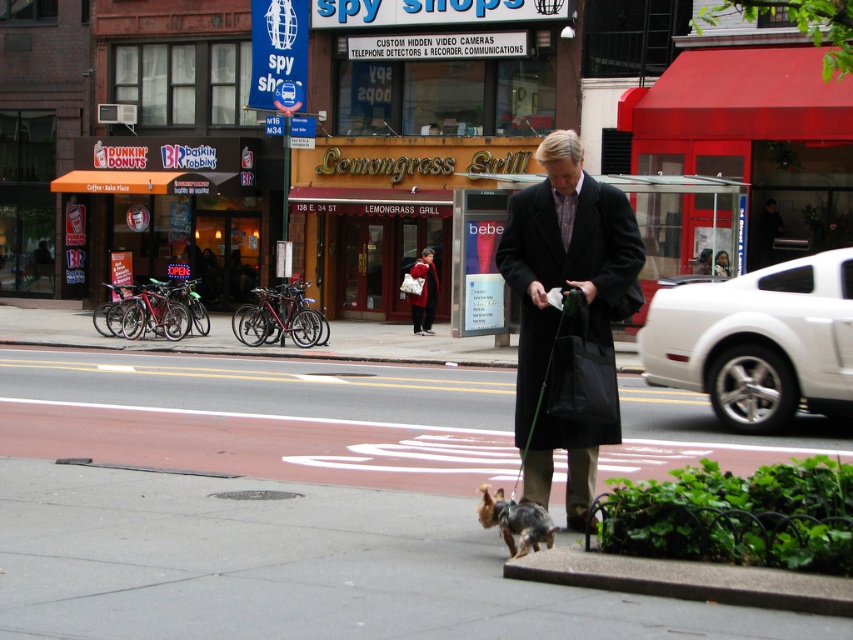
Can you confirm if smooth asphalt pavement at center is smaller than red wool coat at center?

No.

Does smooth asphalt pavement at center have a lesser height compared to red wool coat at center?

Yes, smooth asphalt pavement at center is shorter than red wool coat at center.

Who is more distant from viewer, (x=259, y=516) or (x=421, y=294)?

Point (x=421, y=294)

The height and width of the screenshot is (640, 853). What are the coordinates of `smooth asphalt pavement at center` in the screenshot? It's located at point(283,508).

Does black wool coat at center appear over shiny brown fur at center?

Yes.

Who is higher up, black wool coat at center or shiny brown fur at center?

black wool coat at center

Which is in front, point (515, 420) or point (509, 525)?

Point (509, 525) is in front.

In order to click on black wool coat at center in this screenshot , I will do `click(564, 269)`.

Does black wool coat at center appear under red wool coat at center?

Correct, black wool coat at center is located below red wool coat at center.

Consider the image. Measure the distance between point (587, 186) and camera.

Point (587, 186) and camera are 6.52 meters apart from each other.

The height and width of the screenshot is (640, 853). In order to click on black wool coat at center in this screenshot , I will do `click(564, 269)`.